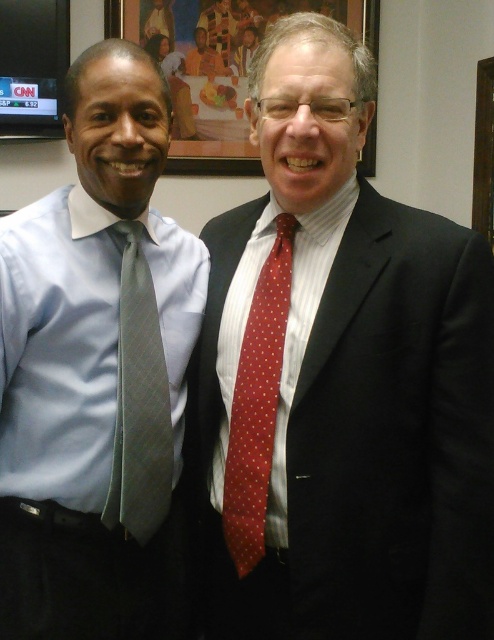
Question: Which object appears farthest from the camera in this image?

Choices:
 (A) red dotted tie at center
 (B) matte gray tie at left
 (C) wooden picture frame at upper center

Answer: (C)

Question: Which object is farther from the camera taking this photo?

Choices:
 (A) red dotted tie at right
 (B) gray textured tie at left

Answer: (B)

Question: Which of these objects is positioned farthest from the gray textured tie at left?

Choices:
 (A) red dotted tie at center
 (B) wooden picture frame at upper center

Answer: (B)

Question: Does wooden picture frame at upper center lie behind red dotted tie at right?

Choices:
 (A) yes
 (B) no

Answer: (A)

Question: In this image, where is matte gray tie at left located relative to red dotted tie at right?

Choices:
 (A) below
 (B) above

Answer: (B)

Question: Can you confirm if wooden picture frame at upper center is positioned below gray textured tie at left?

Choices:
 (A) no
 (B) yes

Answer: (A)